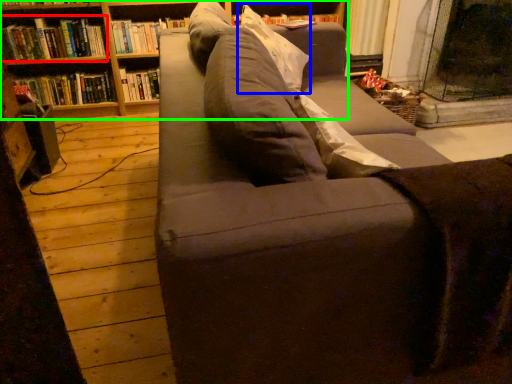
Question: Which is nearer to the book (highlighted by a red box)? pillow (highlighted by a blue box) or bookcase (highlighted by a green box).

Choices:
 (A) pillow
 (B) bookcase

Answer: (B)